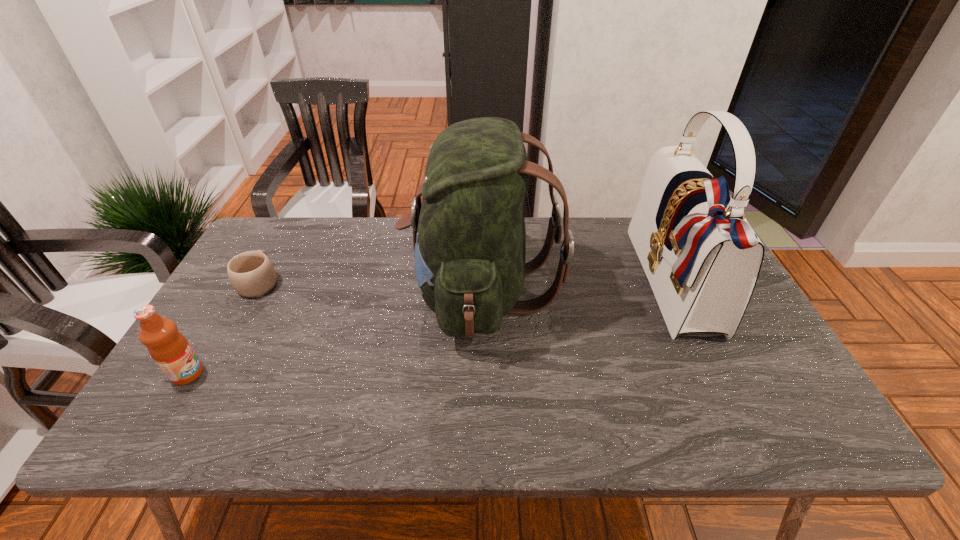
I want to click on empty location between the second object from right to left and the fruit juice, so click(334, 333).

Image resolution: width=960 pixels, height=540 pixels. Identify the location of free space between the mug and the backpack. (371, 287).

Choose which object is the second nearest neighbor to the rightmost object. Please provide its 2D coordinates. Your answer should be formatted as a tuple, i.e. [(x, y)], where the tuple contains the x and y coordinates of a point satisfying the conditions above.

[(252, 274)]

Point out which object is positioned as the third nearest to the backpack. Please provide its 2D coordinates. Your answer should be formatted as a tuple, i.e. [(x, y)], where the tuple contains the x and y coordinates of a point satisfying the conditions above.

[(168, 347)]